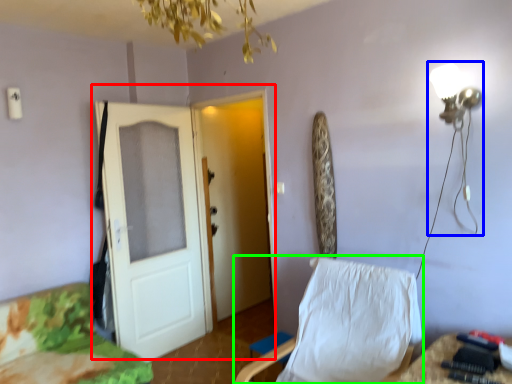
Question: Considering the real-world distances, which object is closest to door (highlighted by a red box)? table lamp (highlighted by a blue box) or chair (highlighted by a green box).

Choices:
 (A) table lamp
 (B) chair

Answer: (B)